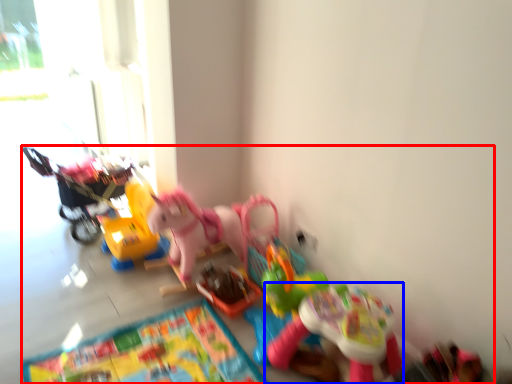
Question: Which object appears farthest to the camera in this image, toy (highlighted by a red box) or toy (highlighted by a blue box)?

Choices:
 (A) toy
 (B) toy

Answer: (B)